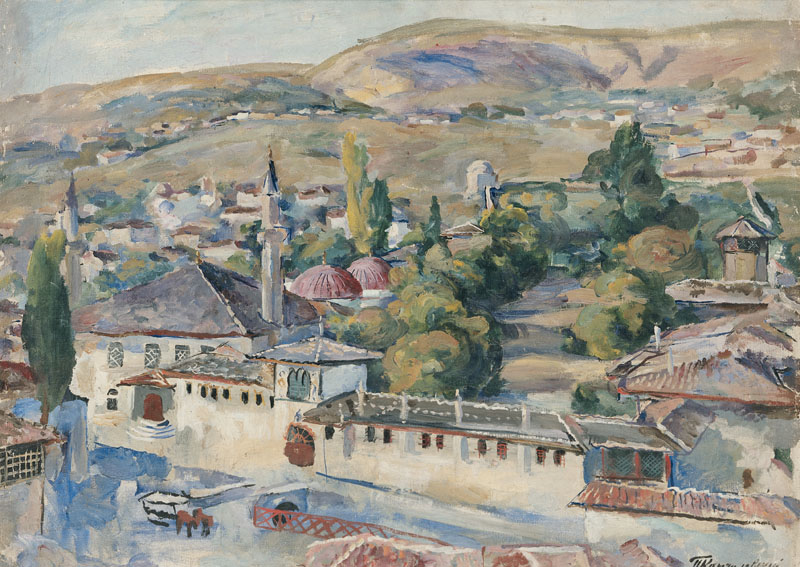
What are the coordinates of `window` in the screenshot? It's located at (106, 400), (113, 354), (150, 342), (169, 344), (278, 379).